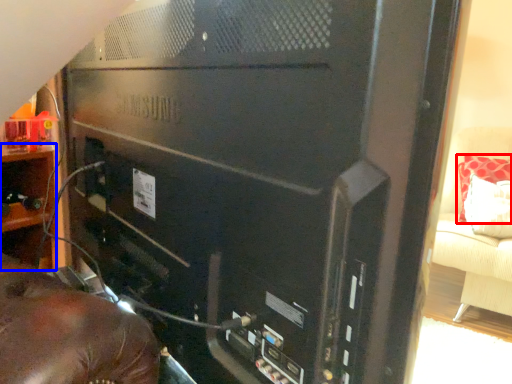
Question: Among these objects, which one is farthest to the camera, pillow (highlighted by a red box) or shelf (highlighted by a blue box)?

Choices:
 (A) pillow
 (B) shelf

Answer: (A)